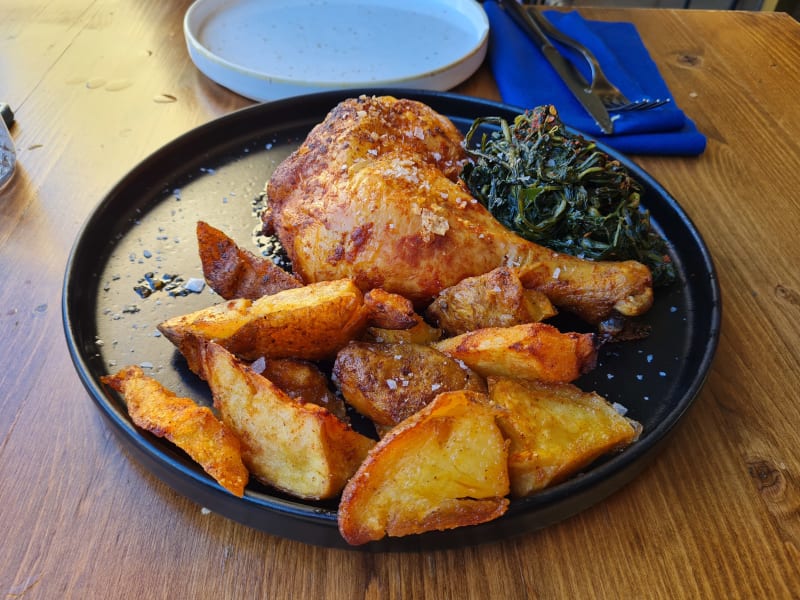
At what (x,y) coordinates should I click in order to perform the action: click on blue napkin. Please return your answer as a coordinate pair (x, y). Looking at the image, I should click on (670, 134).